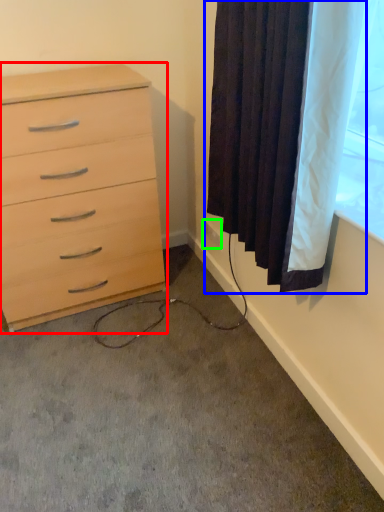
Question: Estimate the real-world distances between objects in this image. Which object is farther from chest of drawers (highlighted by a red box), curtain (highlighted by a blue box) or electric outlet (highlighted by a green box)?

Choices:
 (A) curtain
 (B) electric outlet

Answer: (B)